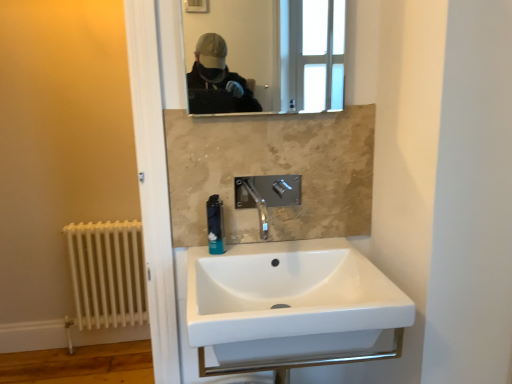
I want to click on unoccupied region to the right of blue plastic soap dispenser at center, so click(269, 255).